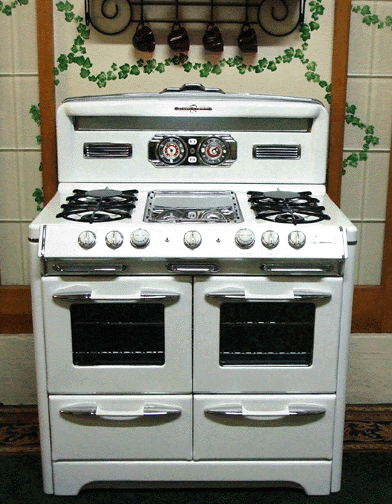
The width and height of the screenshot is (392, 504). Find the location of `oven burners`. oven burners is located at coordinates (100, 206), (82, 192), (263, 195), (271, 210).